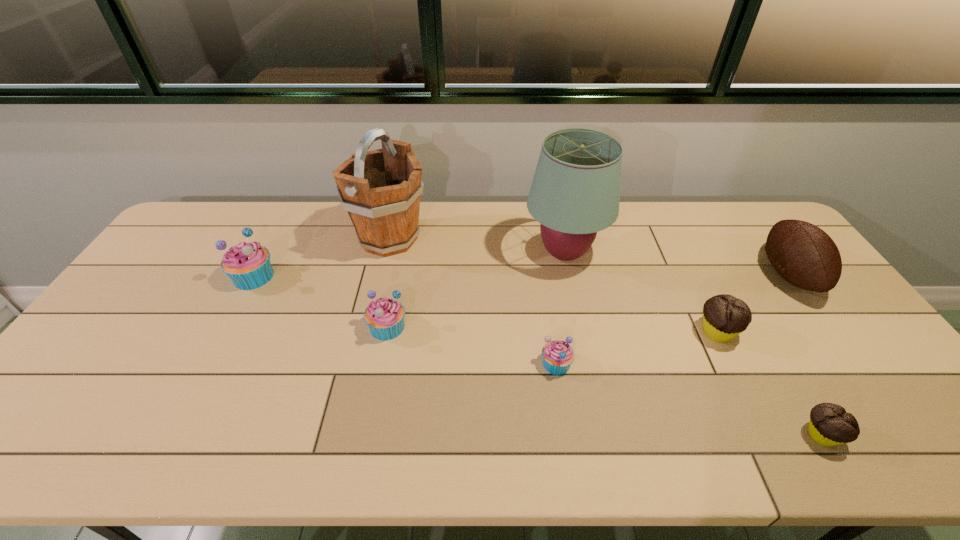
Where is `the third muffin from right to left`? the third muffin from right to left is located at coordinates (557, 355).

This screenshot has width=960, height=540. I want to click on the rightmost blue muffin, so (x=557, y=355).

Image resolution: width=960 pixels, height=540 pixels. What are the coordinates of `the nearest object` in the screenshot? It's located at (830, 425).

Locate an element on the screen. the nearer chocolate muffin is located at coordinates (830, 425).

The width and height of the screenshot is (960, 540). I want to click on free space located 0.350m on the left of the bucket, so click(x=246, y=239).

Image resolution: width=960 pixels, height=540 pixels. Identify the location of free space located on the left of the lampshade. (474, 253).

The height and width of the screenshot is (540, 960). I want to click on vacant space situated on the laces of the brown football, so click(x=701, y=274).

Where is `free space located 0.360m on the laces of the brown football`? The width and height of the screenshot is (960, 540). free space located 0.360m on the laces of the brown football is located at coordinates (646, 274).

The height and width of the screenshot is (540, 960). I want to click on vacant point located 0.250m on the laces of the brown football, so click(x=682, y=274).

Identify the location of vacant space positioned 0.230m on the right of the tallest muffin. (350, 276).